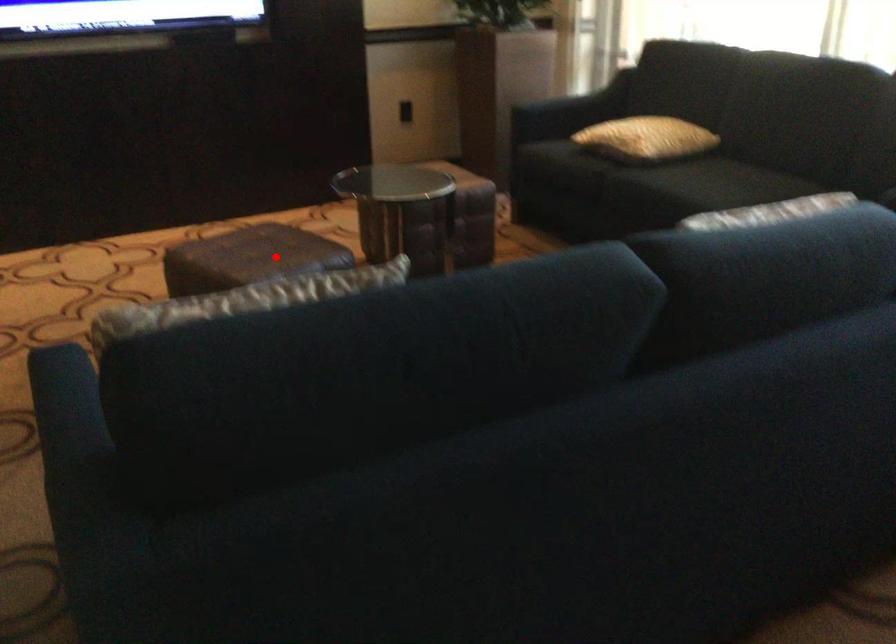
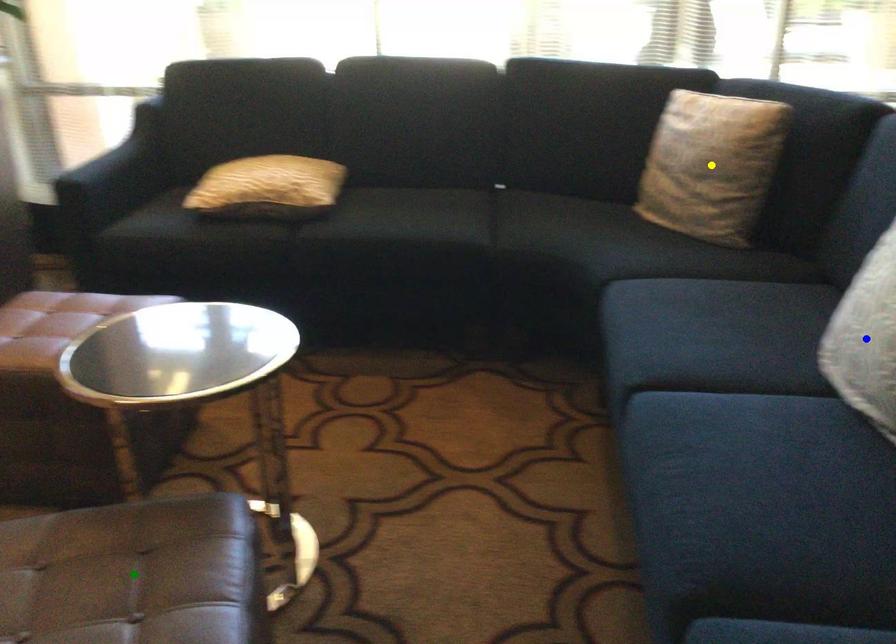
Question: I am providing you with two images of the same scene from different viewpoints. A red point is marked on the first image. You are given multiple points on the second image. Which point in image 2 represents the same 3d spot as the red point in image 1?

Choices:
 (A) green point
 (B) yellow point
 (C) blue point

Answer: (A)